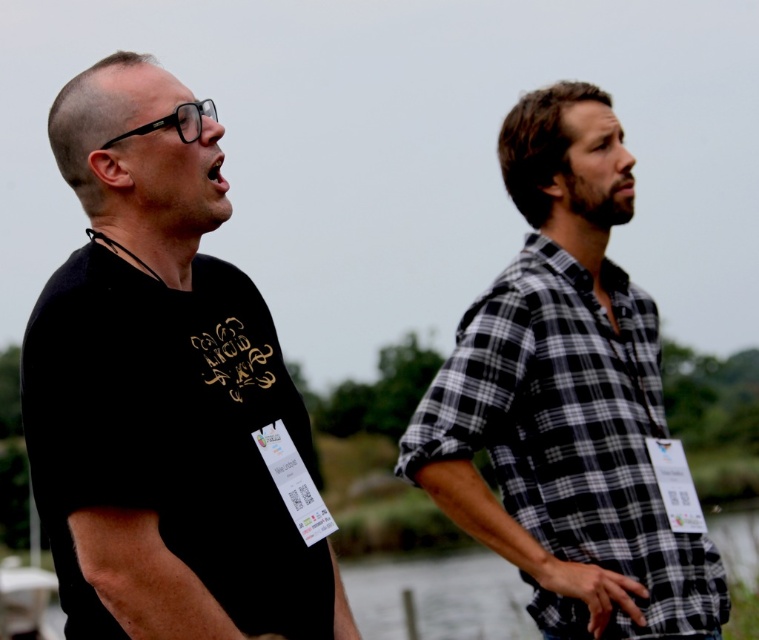
What do you see at coordinates (572, 432) in the screenshot? I see `black checkered shirt at right` at bounding box center [572, 432].

Does point (669, 632) come farther from viewer compared to point (720, 541)?

No, it is not.

Measure the distance between black checkered shirt at right and camera.

They are 6.17 meters apart.

Find the location of `black checkered shirt at right`. black checkered shirt at right is located at coordinates (572, 432).

Can you confirm if black matte t-shirt at left is wider than black checkered shirt at right?

No.

Where is `black matte t-shirt at left`? black matte t-shirt at left is located at coordinates (162, 388).

Does point (39, 371) come behind point (597, 522)?

No, it is in front of (597, 522).

The height and width of the screenshot is (640, 759). Identify the location of black matte t-shirt at left. (162, 388).

Is black matte t-shirt at left positioned in front of clear water at lower center?

That is True.

This screenshot has height=640, width=759. Find the location of `black matte t-shirt at left`. black matte t-shirt at left is located at coordinates (162, 388).

At what (x,y) coordinates should I click in order to perform the action: click on black matte t-shirt at left. Please return your answer as a coordinate pair (x, y). Looking at the image, I should click on (162, 388).